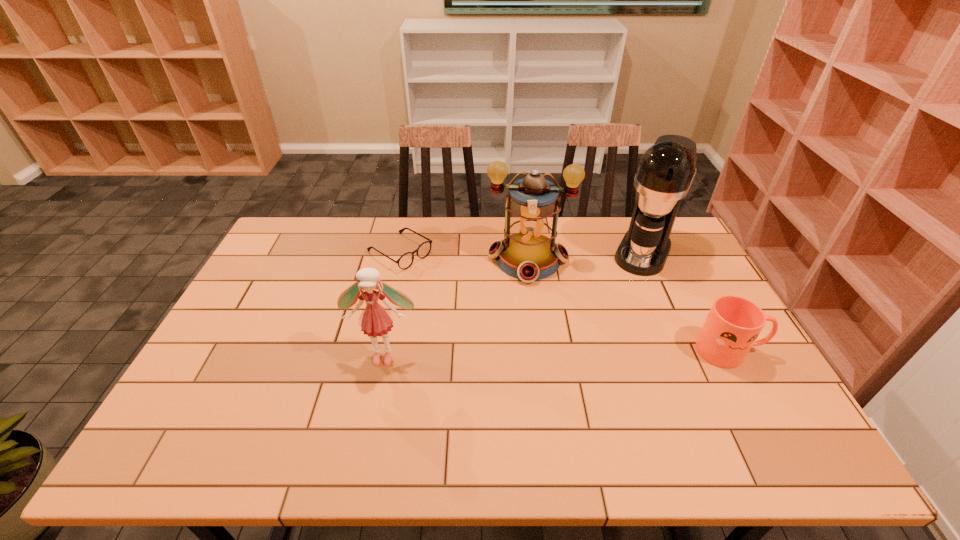
Find the location of a particular element. The image size is (960, 540). free spot between the coffee maker and the third shortest object is located at coordinates (514, 304).

Locate an element on the screen. The width and height of the screenshot is (960, 540). free spot between the doll and the shortest object is located at coordinates (392, 304).

Locate an element on the screen. unoccupied position between the fourth shortest object and the mug is located at coordinates (629, 305).

The width and height of the screenshot is (960, 540). I want to click on empty space between the third shortest object and the coffee maker, so click(514, 304).

This screenshot has width=960, height=540. Find the location of `the third closest object to the shortest object`. the third closest object to the shortest object is located at coordinates (665, 172).

Identify which object is the nearest to the coffee maker. Please provide its 2D coordinates. Your answer should be formatted as a tuple, i.e. [(x, y)], where the tuple contains the x and y coordinates of a point satisfying the conditions above.

[(528, 252)]

This screenshot has width=960, height=540. I want to click on free spot that satisfies the following two spatial constraints: 1. on the front side of the shortest object; 2. on the left side of the coffee maker, so click(400, 252).

Find the location of a particular element. free spot that satisfies the following two spatial constraints: 1. on the back side of the coffee maker; 2. on the right side of the fourth shortest object is located at coordinates (527, 252).

In order to click on vacant space that satisfies the following two spatial constraints: 1. on the front side of the mug; 2. on the handle side of the second tallest object in this screenshot , I will do `click(540, 350)`.

Find the location of `vacant space that satisfies the following two spatial constraints: 1. on the front side of the shortest object; 2. on the handle side of the mug`. vacant space that satisfies the following two spatial constraints: 1. on the front side of the shortest object; 2. on the handle side of the mug is located at coordinates (378, 350).